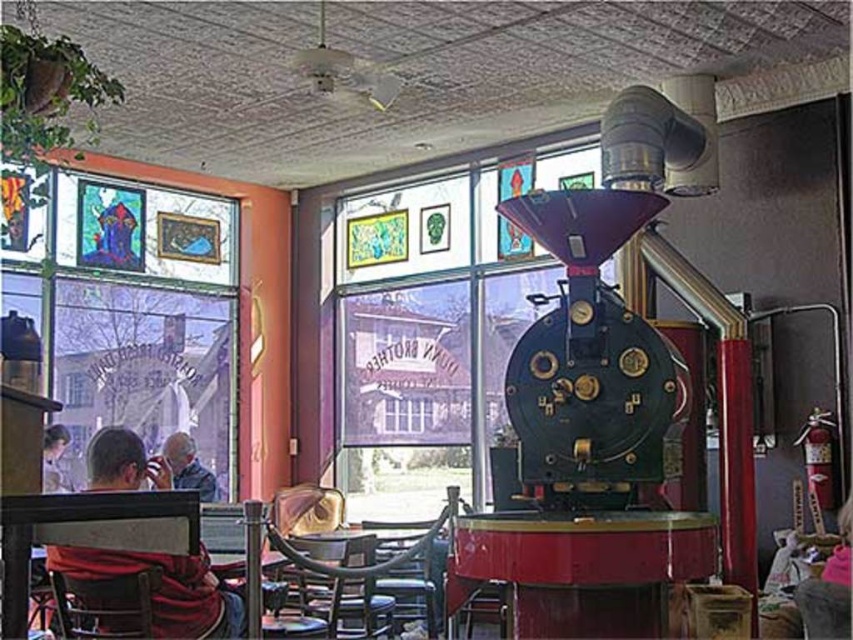
You are a barista who needs to reach both the shiny dark blue metal coffee grinder at center and the red sweater at left. Your arms can extend 1.5 meters. Can you reach both items without moving your position?

The shiny dark blue metal coffee grinder at center and the red sweater at left are 1.82 meters apart. Since your arms can only extend 1.5 meters, you cannot reach both items simultaneously without moving your position.

What is the relationship between the size of the wooden table at center and the pink fabric at lower right in the image?

The wooden table at center is larger in size than the pink fabric at lower right.

You are a customer at the coffee shop and want to grab the red sweater at left. However, the shiny dark blue metal coffee grinder at center is blocking your path. Can you walk around it to reach the sweater?

The red sweater at left is behind the shiny dark blue metal coffee grinder at center, so you can walk around the coffee grinder to reach the sweater.